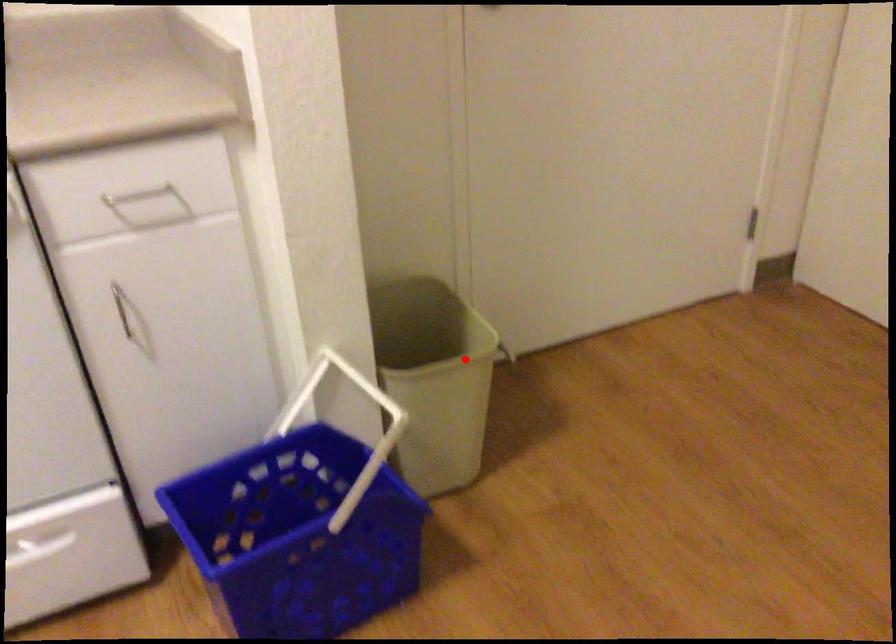
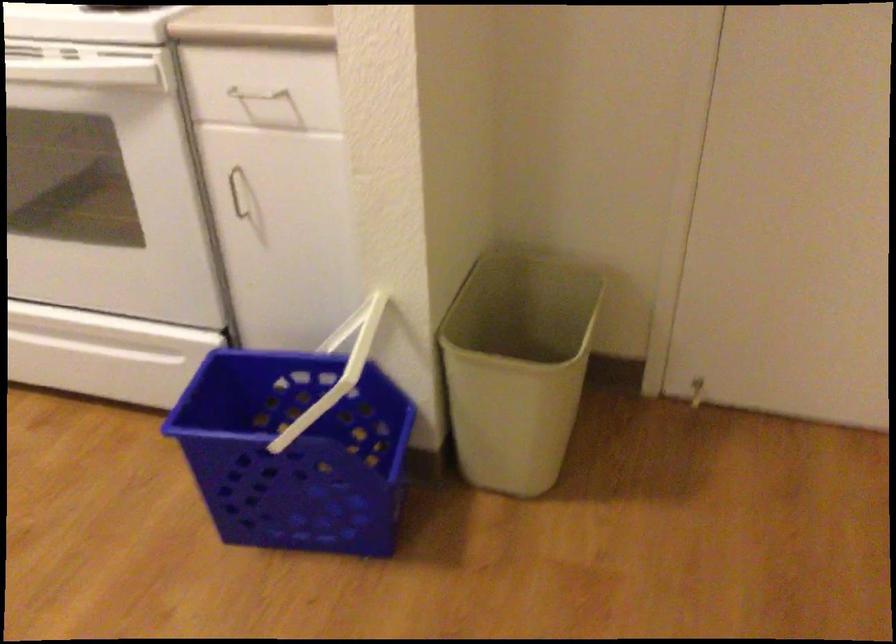
The point at the highlighted location is marked in the first image. Where is the corresponding point in the second image?

(517, 366)